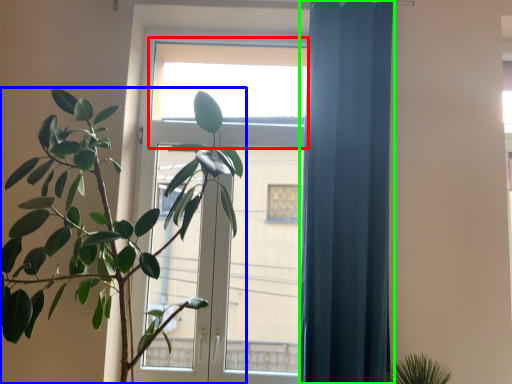
Question: Which is farther away from window (highlighted by a red box)? houseplant (highlighted by a blue box) or curtain (highlighted by a green box)?

Choices:
 (A) houseplant
 (B) curtain

Answer: (A)